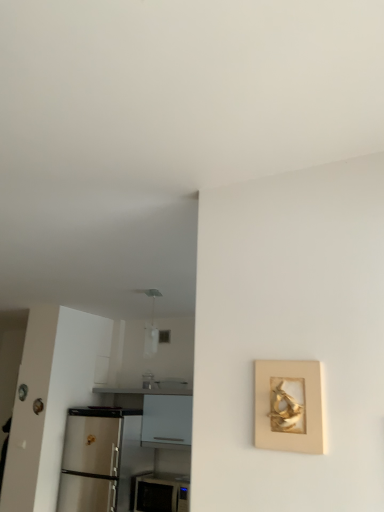
Question: Looking at their shapes, would you say white glossy microwave at lower center is wider or thinner than gold textured frame at right?

Choices:
 (A) thin
 (B) wide

Answer: (B)

Question: Is white glossy microwave at lower center inside the boundaries of gold textured frame at right, or outside?

Choices:
 (A) inside
 (B) outside

Answer: (B)

Question: Which object is positioned closest to the gold textured frame at right?

Choices:
 (A) white glossy microwave at lower center
 (B) white glossy counter at lower left

Answer: (A)

Question: Estimate the real-world distances between objects in this image. Which object is farther from the gold textured frame at right?

Choices:
 (A) white glossy counter at lower left
 (B) white glossy microwave at lower center

Answer: (A)